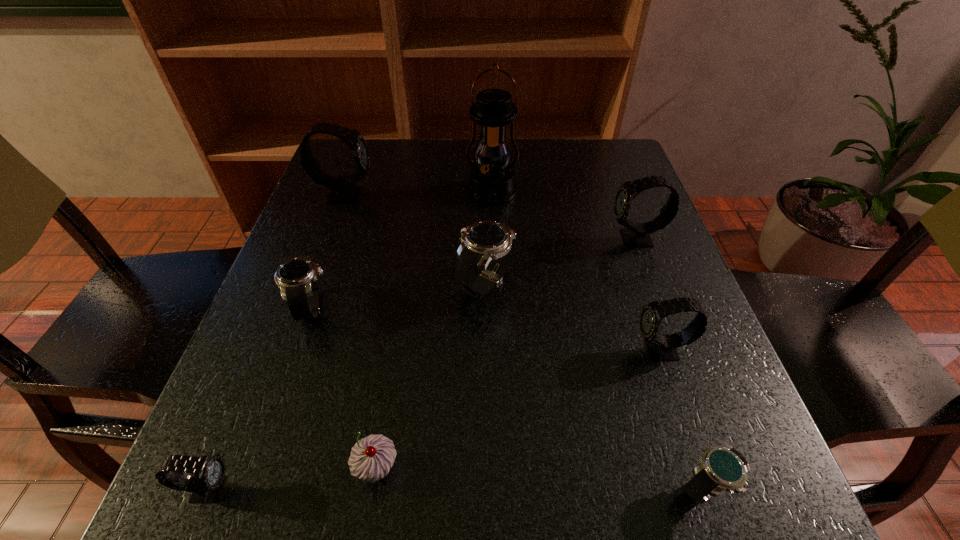
Where is `the second smallest silver watch`? This screenshot has width=960, height=540. the second smallest silver watch is located at coordinates (297, 278).

Where is `the sixth object from right to left`? The width and height of the screenshot is (960, 540). the sixth object from right to left is located at coordinates (372, 457).

At what (x,y) coordinates should I click in order to perform the action: click on gray cupcake. Please return your answer as a coordinate pair (x, y). Looking at the image, I should click on (372, 457).

You are a GUI agent. You are given a task and a screenshot of the screen. Output one action in this format:
    pyautogui.click(x=<x>, y=<y>)
    Task: Click on the smallest gray watch
    The height and width of the screenshot is (540, 960).
    Given the screenshot: What is the action you would take?
    pyautogui.click(x=205, y=485)

Locate an element on the screen. the shortest object is located at coordinates (725, 468).

Locate an element on the screen. This screenshot has width=960, height=540. the nearest silver watch is located at coordinates (725, 468).

Locate any vacant position located 0.150m above the lantern, indicating its light source in the image. Please provide its 2D coordinates. Your answer should be formatted as a tuple, i.e. [(x, y)], where the tuple contains the x and y coordinates of a point satisfying the conditions above.

[(493, 252)]

The height and width of the screenshot is (540, 960). I want to click on free space located on the face of the tallest watch, so [531, 195].

Where is `blank area located on the face of the second tallest watch`? Image resolution: width=960 pixels, height=540 pixels. blank area located on the face of the second tallest watch is located at coordinates (571, 239).

Locate an element on the screen. vacant area situated 0.160m on the face of the second tallest watch is located at coordinates (535, 239).